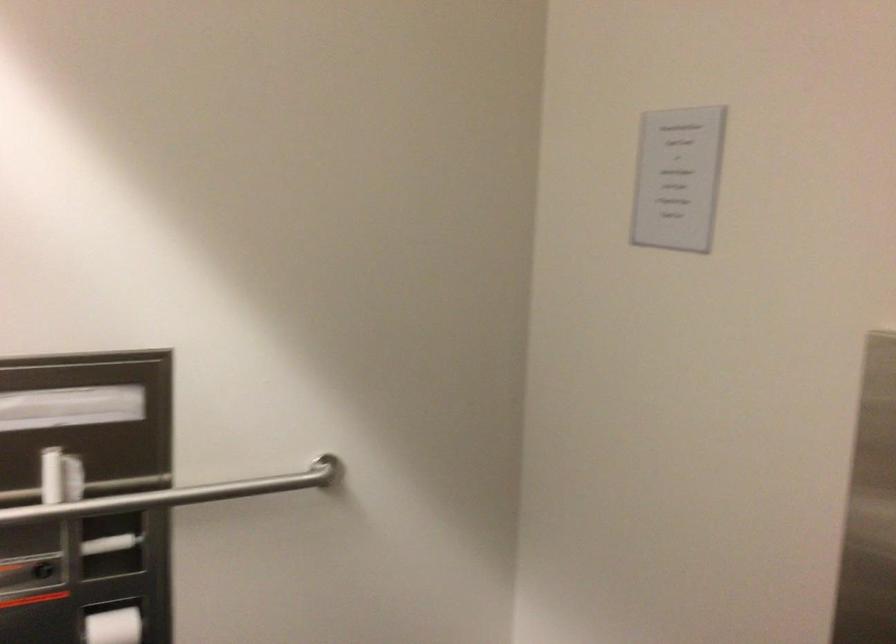
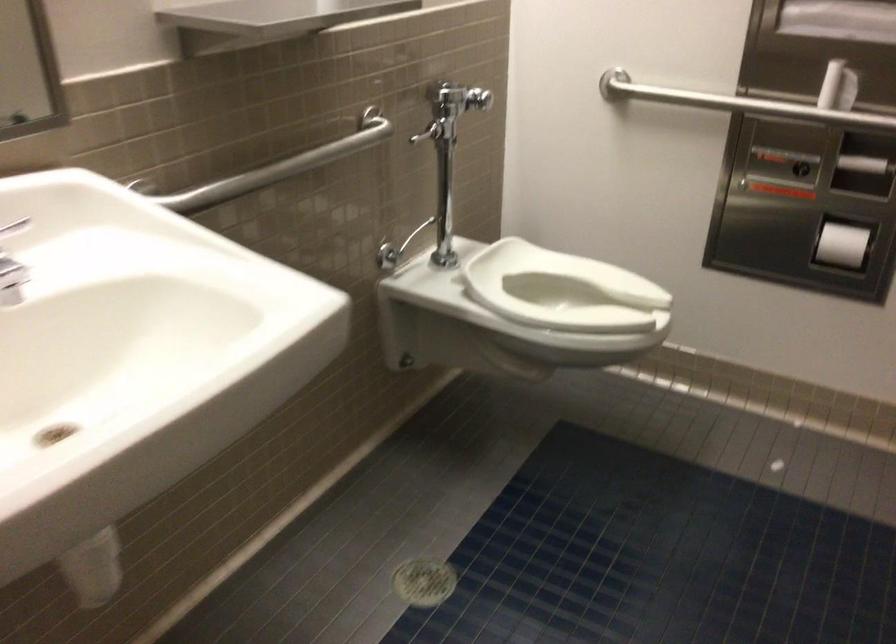
The images are taken continuously from a first-person perspective. In which direction is your viewpoint rotating?

The camera's rotation is toward left-down.